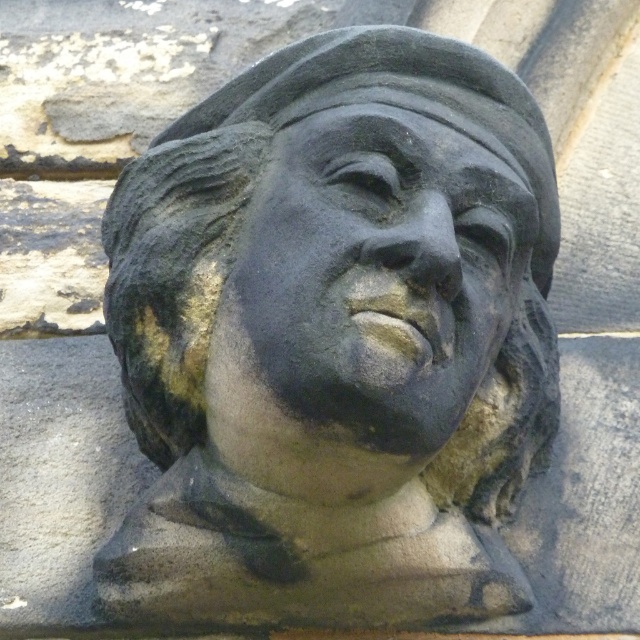
You are an archaeologist examining the stone sculpture. You notice a specific point marked at coordinates (333, 339). What does this point indicate?

The point at (333, 339) marks the location of the black stone bust at center.

You are an archaeologist examining the image. You need to locate the black stone bust at center. What are its coordinates?

The black stone bust at center is located at coordinates point (333, 339).